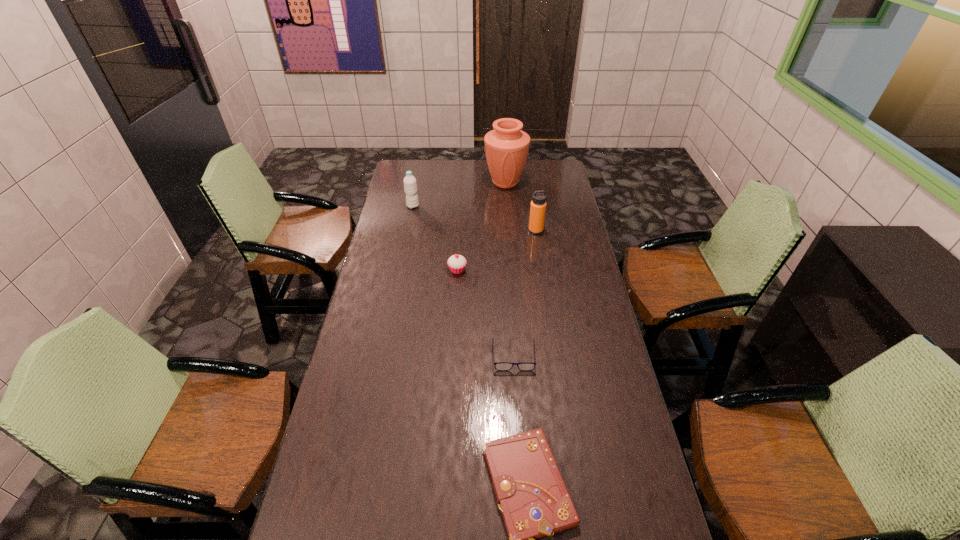
Locate an element on the screen. The image size is (960, 540). vacant area located 0.300m on the front of the fifth nearest object is located at coordinates (404, 250).

You are a GUI agent. You are given a task and a screenshot of the screen. Output one action in this format:
    pyautogui.click(x=<x>, y=<y>)
    Task: Click on the blank area located on the left of the cupcake
    This screenshot has height=540, width=960.
    Given the screenshot: What is the action you would take?
    pyautogui.click(x=385, y=270)

I want to click on free point located on the front-facing side of the fifth farthest object, so click(517, 408).

Identify the location of object that is at the far edge. (506, 147).

You are a GUI agent. You are given a task and a screenshot of the screen. Output one action in this format:
    pyautogui.click(x=<x>, y=<y>)
    Task: Click on the object at the left edge
    
    Given the screenshot: What is the action you would take?
    pyautogui.click(x=410, y=186)

Where is `object positioned at the right edge`? This screenshot has height=540, width=960. object positioned at the right edge is located at coordinates (538, 204).

In the image, there is a desktop. Identify the location of free space at the far edge. This screenshot has height=540, width=960. (440, 160).

The height and width of the screenshot is (540, 960). In the image, there is a desktop. In order to click on free space at the left edge in this screenshot , I will do `click(363, 318)`.

In the image, there is a desktop. Find the location of `free space at the right edge`. free space at the right edge is located at coordinates point(605,338).

This screenshot has height=540, width=960. In the image, there is a desktop. Identify the location of vacant space at the far left corner. (420, 181).